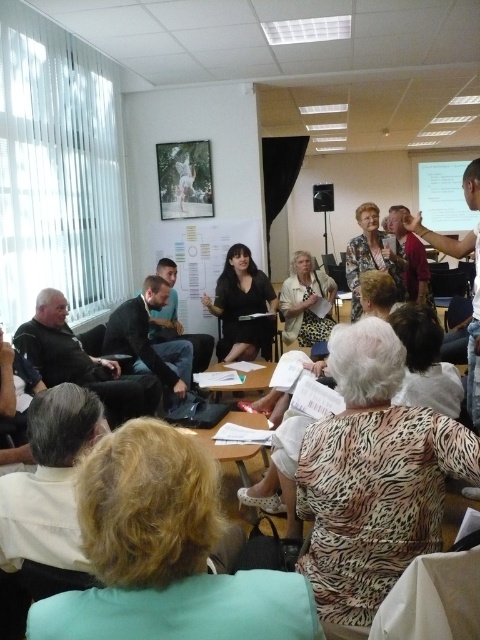
Question: Which point appears closest to the camera in this image?

Choices:
 (A) (320, 208)
 (B) (208, 275)

Answer: (B)

Question: Based on their relative distances, which object is farther from the white paperboard at center?

Choices:
 (A) white fabric dress at center
 (B) black matte dress at center
 (C) matte black microphone at center
 (D) leopard print blouse at center

Answer: (D)

Question: Does dark gray suit at center have a lesser width compared to white fabric dress at center?

Choices:
 (A) yes
 (B) no

Answer: (B)

Question: Can you confirm if leopard print blouse at center is thinner than white paperboard at center?

Choices:
 (A) no
 (B) yes

Answer: (B)

Question: Is leopard print blouse at center positioned before white fabric dress at center?

Choices:
 (A) no
 (B) yes

Answer: (B)

Question: Estimate the real-world distances between objects in this image. Which object is closer to the white fabric dress at center?

Choices:
 (A) white paperboard at center
 (B) black matte dress at center

Answer: (B)